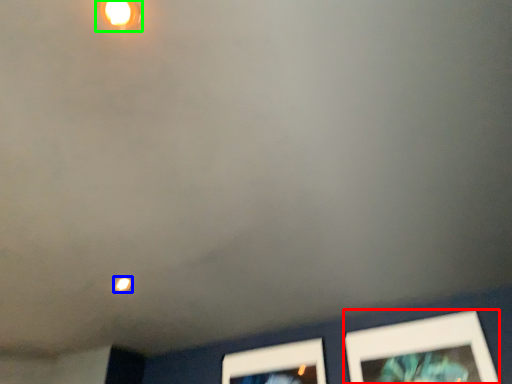
Question: Which is farther away from picture frame (highlighted by a red box)? light (highlighted by a blue box) or light fixture (highlighted by a green box)?

Choices:
 (A) light
 (B) light fixture

Answer: (B)